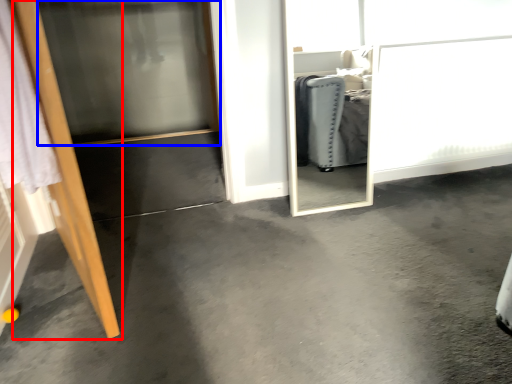
Question: Which of the following is the closest to the observer, door (highlighted by a red box) or screen door (highlighted by a blue box)?

Choices:
 (A) door
 (B) screen door

Answer: (A)